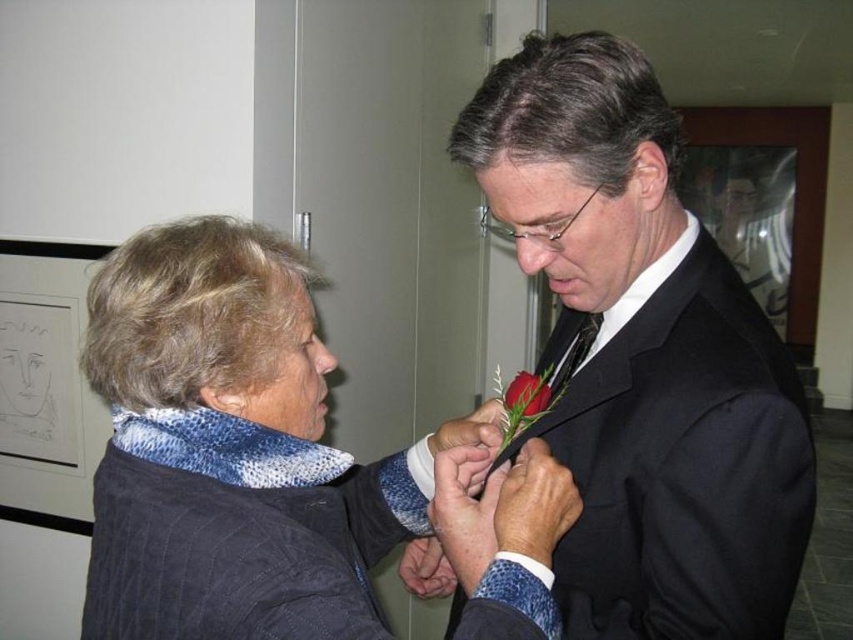
You are a fashion designer analyzing the image. You need to determine which item would require more fabric to create between the black satin suit at center and the blue textured scarf at left. Based on the scene, which one would need more fabric?

The black satin suit at center is larger in size than the blue textured scarf at left, so it would require more fabric to create.

Based on the photo, you are standing at the origin point in the image. Which of the two points, point (635, 186) or point (502, 396), is closer to you?

Point (635, 186) is in front of point (502, 396), so it is closer to you.